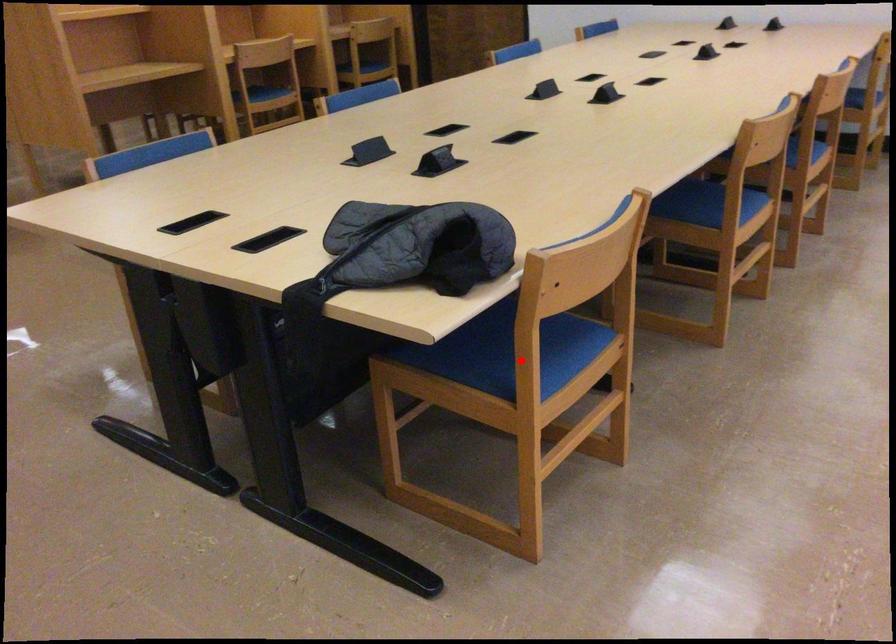
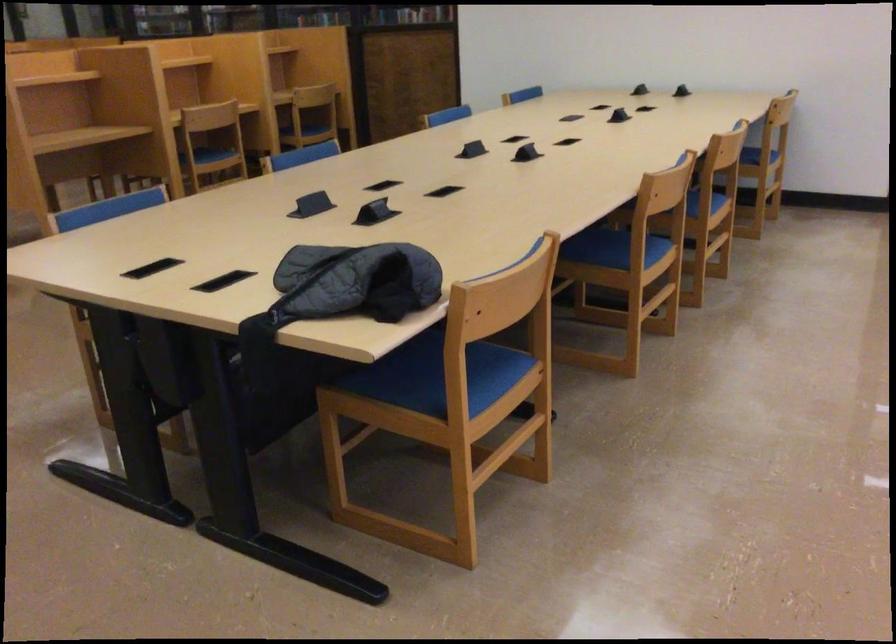
Question: I am providing you with two images of the same scene from different viewpoints. Image1 has a red point marked. In image2, the corresponding 3D location appears at what relative position? Reply with the corresponding letter.

Choices:
 (A) Closer
 (B) Farther

Answer: (B)